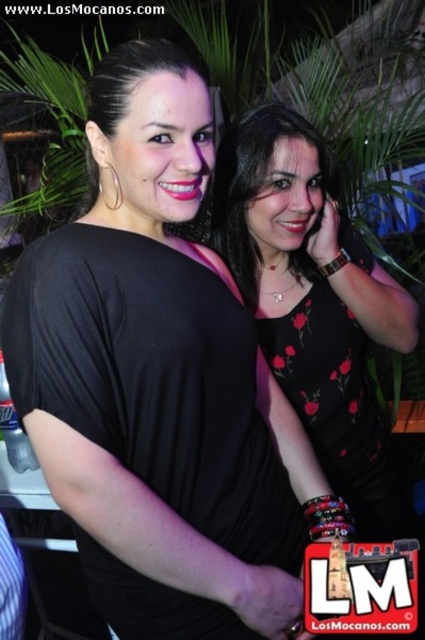
Question: Which point is farther to the camera?

Choices:
 (A) matte black dress at center
 (B) black floral dress at center

Answer: (B)

Question: Does black floral dress at center have a larger size compared to matte black dress at center?

Choices:
 (A) yes
 (B) no

Answer: (A)

Question: From the image, what is the correct spatial relationship of black floral dress at center in relation to matte black dress at center?

Choices:
 (A) right
 (B) left

Answer: (A)

Question: Is black floral dress at center below matte black dress at center?

Choices:
 (A) yes
 (B) no

Answer: (A)